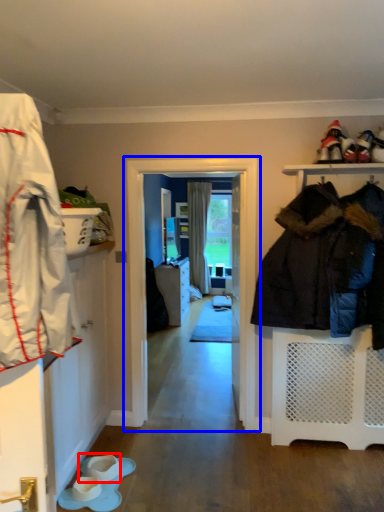
Question: Which object appears closest to the camera in this image, footwear (highlighted by a red box) or screen door (highlighted by a blue box)?

Choices:
 (A) footwear
 (B) screen door

Answer: (A)